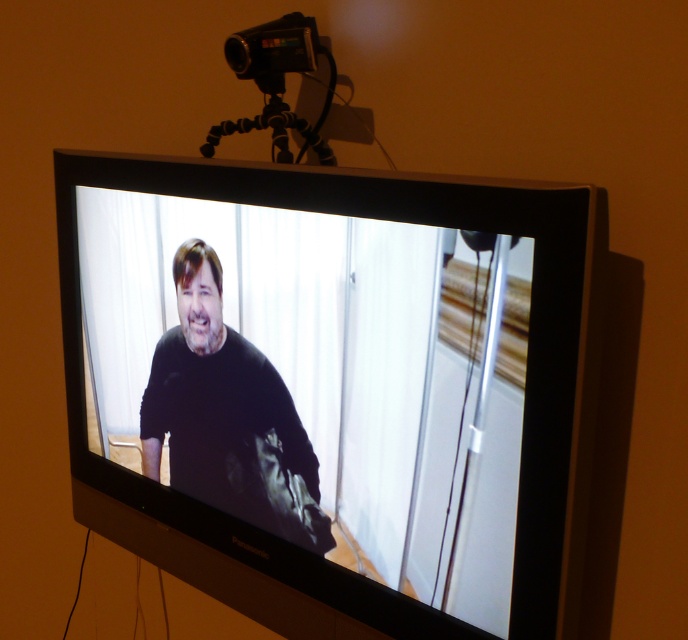
Does black glossy tv at center appear on the right side of black rubber tripod at upper center?

Incorrect, black glossy tv at center is not on the right side of black rubber tripod at upper center.

Does point (89, 282) lie in front of point (283, 116)?

No, it is not.

Which is behind, point (322, 276) or point (322, 145)?

Point (322, 145)

The height and width of the screenshot is (640, 688). In order to click on black glossy tv at center in this screenshot , I will do [314, 380].

Does black glossy tv at center have a larger size compared to black matte shirt at center?

Yes.

Does black glossy tv at center appear over black matte shirt at center?

Indeed, black glossy tv at center is positioned over black matte shirt at center.

Is point (440, 474) closer to viewer compared to point (178, 445)?

Yes.

Find the location of a particular element. The image size is (688, 640). black glossy tv at center is located at coordinates (314, 380).

Is point (230, 209) closer to viewer compared to point (288, 29)?

Yes, it is.

Identify the location of black glossy tv at center. The width and height of the screenshot is (688, 640). (314, 380).